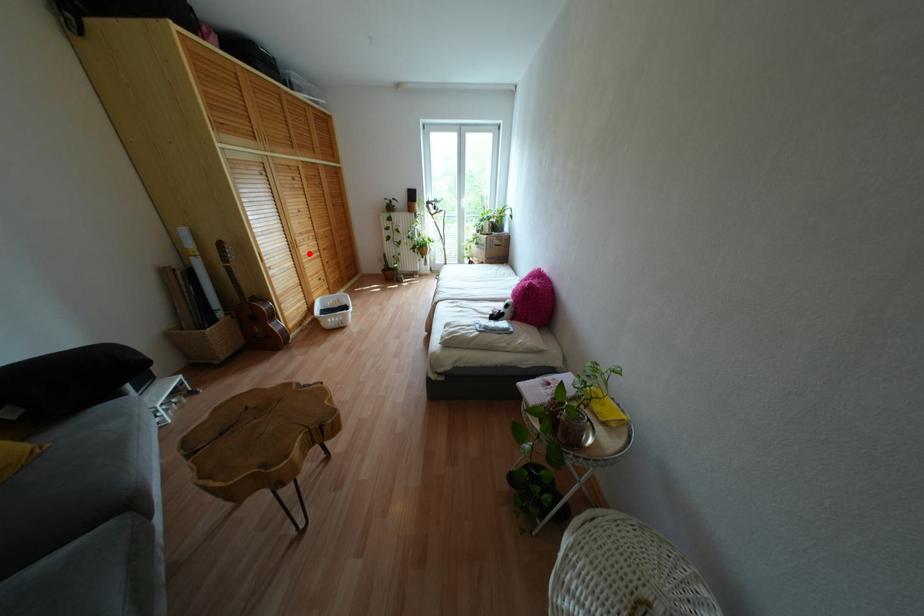
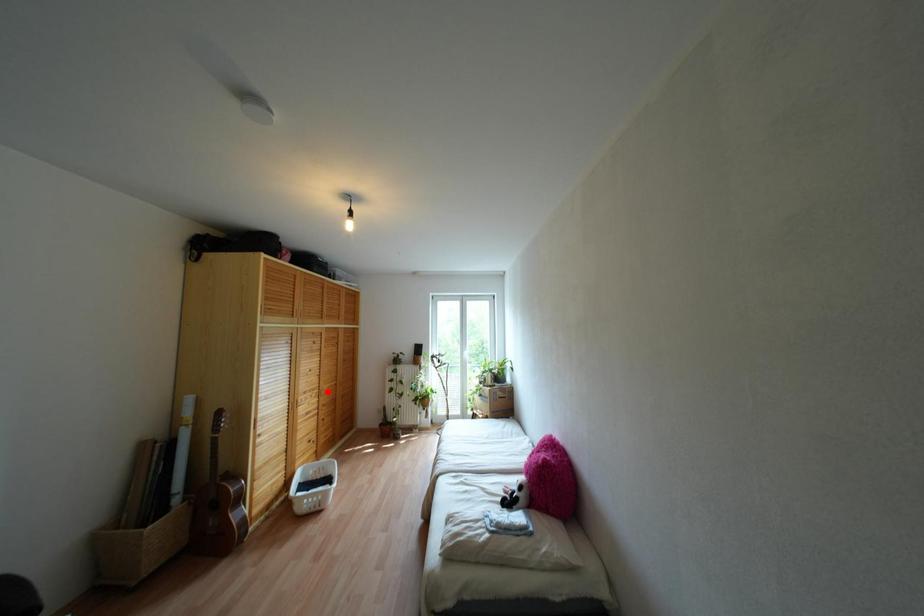
I am providing you with two images of the same scene from different viewpoints. A red point is marked on the first image and another point is marked on the second image. Does the point marked in image1 correspond to the same location as the one in image2?

No